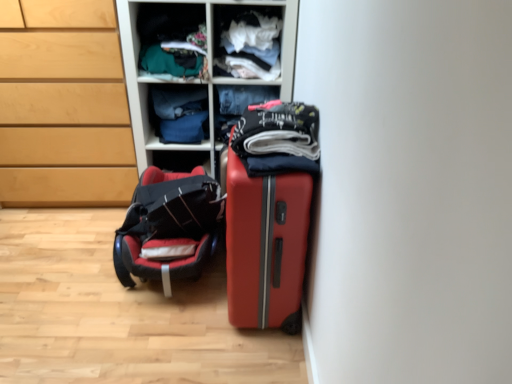
Locate an element on the screen. Image resolution: width=512 pixels, height=384 pixels. denim jeans at center, positioned as the 5th clothing in front-to-back order is located at coordinates (180, 113).

What do you see at coordinates (170, 38) in the screenshot? I see `matte green fabric at upper center, the 3th clothing from the back` at bounding box center [170, 38].

The image size is (512, 384). What do you see at coordinates (168, 227) in the screenshot?
I see `black leather baby car seat at lower left` at bounding box center [168, 227].

Looking at this image, what is the approximate height of white cotton shirt at upper center, the second clothing when ordered from front to back?

white cotton shirt at upper center, the second clothing when ordered from front to back, is 11.90 inches in height.

Where is `matte plastic shelves at upper center`? The width and height of the screenshot is (512, 384). matte plastic shelves at upper center is located at coordinates point(195,78).

How far apart are matte green fabric at upper center, the third clothing from the front, and matte red suitcase at center?

matte green fabric at upper center, the third clothing from the front, and matte red suitcase at center are 36.00 inches apart.

Considering the sizes of objects matte green fabric at upper center, the 3th clothing from the back, and matte red suitcase at center in the image provided, who is taller, matte green fabric at upper center, the 3th clothing from the back, or matte red suitcase at center?

matte red suitcase at center.

Considering the relative positions of matte green fabric at upper center, the 3th clothing from the back, and matte red suitcase at center in the image provided, is matte green fabric at upper center, the 3th clothing from the back, to the right of matte red suitcase at center from the viewer's perspective?

Incorrect, matte green fabric at upper center, the 3th clothing from the back, is not on the right side of matte red suitcase at center.

Is black leather baby car seat at lower left positioned with its back to matte wood chest of drawers at left?

No, matte wood chest of drawers at left is not at the back of black leather baby car seat at lower left.

Is black leather baby car seat at lower left placed right next to matte wood chest of drawers at left?

No, black leather baby car seat at lower left is not in contact with matte wood chest of drawers at left.

Which is more to the right, black leather baby car seat at lower left or matte wood chest of drawers at left?

From the viewer's perspective, black leather baby car seat at lower left appears more on the right side.

Could you tell me if dark gray cotton shirt at center, which is counted as the 1th clothing, starting from the front, is facing matte red suitcase at center?

No, dark gray cotton shirt at center, which is counted as the 1th clothing, starting from the front, is not aimed at matte red suitcase at center.

Is dark gray cotton shirt at center, which is counted as the 1th clothing, starting from the front, bigger than matte red suitcase at center?

No.

From a real-world perspective, who is located lower, dark gray cotton shirt at center, which is counted as the 1th clothing, starting from the front, or matte red suitcase at center?

matte red suitcase at center.

Which is in front, dark gray cotton shirt at center, the 5th clothing from the back, or matte red suitcase at center?

dark gray cotton shirt at center, the 5th clothing from the back, is closer to the camera.

From a real-world perspective, relative to matte plastic shelves at upper center, is dark gray cotton shirt at center, the 5th clothing from the back, vertically above or below?

In terms of real-world spatial position, dark gray cotton shirt at center, the 5th clothing from the back, is above matte plastic shelves at upper center.

Is matte plastic shelves at upper center at the back of dark gray cotton shirt at center, the 5th clothing from the back?

No, matte plastic shelves at upper center is not at the back of dark gray cotton shirt at center, the 5th clothing from the back.

Consider the image. Is matte green fabric at upper center, the 3th clothing from the back, at the right side of matte plastic shelves at upper center?

No, matte green fabric at upper center, the 3th clothing from the back, is not to the right of matte plastic shelves at upper center.

From a real-world perspective, does matte green fabric at upper center, the third clothing from the front, sit lower than matte plastic shelves at upper center?

No, from a real-world perspective, matte green fabric at upper center, the third clothing from the front, is not beneath matte plastic shelves at upper center.

Which of these two, matte green fabric at upper center, the 3th clothing from the back, or matte plastic shelves at upper center, stands taller?

With more height is matte plastic shelves at upper center.

Between matte green fabric at upper center, the third clothing from the front, and denim jeans at center, marked as the 1th clothing in a back-to-front arrangement, which one appears on the right side from the viewer's perspective?

matte green fabric at upper center, the third clothing from the front.

Is matte green fabric at upper center, the third clothing from the front, facing away from denim jeans at center, positioned as the 5th clothing in front-to-back order?

No, matte green fabric at upper center, the third clothing from the front, is not facing the opposite direction of denim jeans at center, positioned as the 5th clothing in front-to-back order.

From the image's perspective, which is above, matte green fabric at upper center, the 3th clothing from the back, or denim jeans at center, positioned as the 5th clothing in front-to-back order?

matte green fabric at upper center, the 3th clothing from the back, appears higher in the image.

How much distance is there between dark gray cotton shirt at center, which is counted as the 1th clothing, starting from the front, and matte wood chest of drawers at left?

dark gray cotton shirt at center, which is counted as the 1th clothing, starting from the front, is 1.10 meters away from matte wood chest of drawers at left.

From a real-world perspective, is dark gray cotton shirt at center, the 5th clothing from the back, below matte wood chest of drawers at left?

No, from a real-world perspective, dark gray cotton shirt at center, the 5th clothing from the back, is not beneath matte wood chest of drawers at left.

Is dark gray cotton shirt at center, which is counted as the 1th clothing, starting from the front, taller than matte wood chest of drawers at left?

Incorrect, the height of dark gray cotton shirt at center, which is counted as the 1th clothing, starting from the front, is not larger of that of matte wood chest of drawers at left.

In terms of width, does dark gray cotton shirt at center, which is counted as the 1th clothing, starting from the front, look wider or thinner when compared to matte wood chest of drawers at left?

Considering their sizes, dark gray cotton shirt at center, which is counted as the 1th clothing, starting from the front, looks slimmer than matte wood chest of drawers at left.

Locate an element on the screen. This screenshot has height=384, width=512. suitcase below the matte green fabric at upper center, the 3th clothing from the back (from the image's perspective) is located at coordinates (268, 216).

Image resolution: width=512 pixels, height=384 pixels. I want to click on chest of drawers behind the black leather baby car seat at lower left, so click(x=63, y=106).

Based on their spatial positions, is matte plastic shelves at upper center or denim jeans at center, positioned as the 5th clothing in front-to-back order, closer to matte red suitcase at center?

matte plastic shelves at upper center.

When comparing their distances from dark gray cotton shirt at center, which is counted as the 1th clothing, starting from the front, does matte wood chest of drawers at left or white cotton shirt at upper center, the second clothing when ordered from front to back, seem closer?

white cotton shirt at upper center, the second clothing when ordered from front to back.

Estimate the real-world distances between objects in this image. Which object is further from matte wood chest of drawers at left, denim jeans at center, marked as the second clothing in a back-to-front arrangement, or matte plastic shelves at upper center?

Based on the image, denim jeans at center, marked as the second clothing in a back-to-front arrangement, appears to be further to matte wood chest of drawers at left.

Consider the image. Which object lies further to the anchor point matte wood chest of drawers at left, dark gray cotton shirt at center, the 5th clothing from the back, or black leather baby car seat at lower left?

Based on the image, dark gray cotton shirt at center, the 5th clothing from the back, appears to be further to matte wood chest of drawers at left.

Estimate the real-world distances between objects in this image. Which object is further from matte wood chest of drawers at left, matte red suitcase at center or matte green fabric at upper center, the 3th clothing from the back?

Among the two, matte red suitcase at center is located further to matte wood chest of drawers at left.

Which object lies nearer to the anchor point matte green fabric at upper center, the third clothing from the front, denim jeans at center, positioned as the 5th clothing in front-to-back order, or black leather baby car seat at lower left?

denim jeans at center, positioned as the 5th clothing in front-to-back order, is positioned closer to the anchor matte green fabric at upper center, the third clothing from the front.

Considering their positions, is matte wood chest of drawers at left positioned closer to matte plastic shelves at upper center than matte red suitcase at center?

Based on the image, matte wood chest of drawers at left appears to be nearer to matte plastic shelves at upper center.

Based on their spatial positions, is black leather baby car seat at lower left or dark gray cotton shirt at center, which is counted as the 1th clothing, starting from the front, closer to matte wood chest of drawers at left?

Based on the image, black leather baby car seat at lower left appears to be nearer to matte wood chest of drawers at left.

Where is `shelf between denim jeans at center, marked as the 1th clothing in a back-to-front arrangement, and white cotton shirt at upper center, the second clothing when ordered from front to back, in the horizontal direction`? shelf between denim jeans at center, marked as the 1th clothing in a back-to-front arrangement, and white cotton shirt at upper center, the second clothing when ordered from front to back, in the horizontal direction is located at coordinates (195, 78).

Identify the location of shelf between dark gray cotton shirt at center, which is counted as the 1th clothing, starting from the front, and white cotton shirt at upper center, the second clothing when ordered from front to back, along the z-axis. This screenshot has width=512, height=384. (195, 78).

Locate an element on the screen. luggage and bags situated between matte wood chest of drawers at left and denim jeans at center, marked as the second clothing in a back-to-front arrangement, from left to right is located at coordinates (168, 227).

Where is `suitcase located between dark gray cotton shirt at center, which is counted as the 1th clothing, starting from the front, and denim jeans at center, positioned as the 5th clothing in front-to-back order, in the depth direction`? This screenshot has width=512, height=384. suitcase located between dark gray cotton shirt at center, which is counted as the 1th clothing, starting from the front, and denim jeans at center, positioned as the 5th clothing in front-to-back order, in the depth direction is located at coordinates (268, 216).